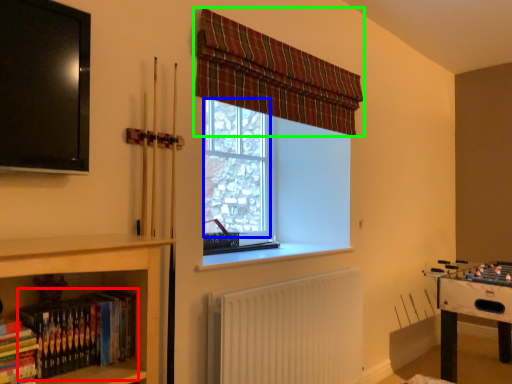
Question: Based on their relative distances, which object is nearer to book (highlighted by a red box)? Choose from bay window (highlighted by a blue box) and curtain (highlighted by a green box).

Choices:
 (A) bay window
 (B) curtain

Answer: (B)